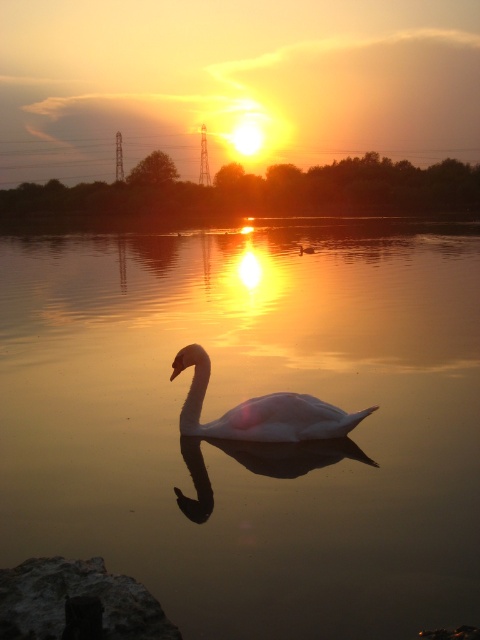
Can you confirm if gray rough rock at lower left is positioned above white glossy swan at center?

Actually, gray rough rock at lower left is below white glossy swan at center.

Measure the distance between point (95, 604) and camera.

A distance of 7.66 feet exists between point (95, 604) and camera.

What do you see at coordinates (76, 602) in the screenshot?
I see `gray rough rock at lower left` at bounding box center [76, 602].

Image resolution: width=480 pixels, height=640 pixels. In order to click on gray rough rock at lower left in this screenshot , I will do `click(76, 602)`.

Is smooth water at center positioned at the back of white glossy swan at center?

That is False.

Can you confirm if smooth water at center is taller than white glossy swan at center?

Yes.

Does point (136, 524) come farther from viewer compared to point (207, 364)?

No, (136, 524) is closer to viewer.

This screenshot has width=480, height=640. What are the coordinates of `smooth water at center` in the screenshot? It's located at (243, 400).

Does point (462, 314) come in front of point (34, 573)?

No.

In the scene shown: Does smooth water at center appear over gray rough rock at lower left?

Yes, smooth water at center is above gray rough rock at lower left.

In order to click on smooth water at center in this screenshot , I will do `click(243, 400)`.

This screenshot has height=640, width=480. Find the location of `smooth water at center`. smooth water at center is located at coordinates (243, 400).